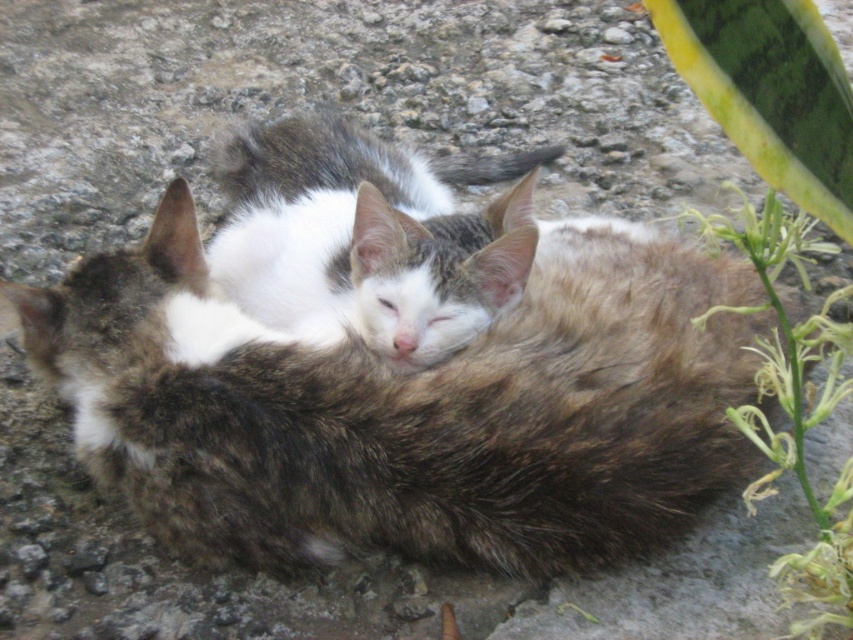
You are a photographer trying to capture a photo of the fluffy brown cat at center and the green leafy plant at right. If you want to ensure both subjects are fully visible in the frame, which one should you position closer to the camera to avoid cropping?

The fluffy brown cat at center might be wider than the green leafy plant at right, so positioning the fluffy brown cat at center closer to the camera would help ensure it fits without cropping, while the narrower green leafy plant at right could be placed slightly farther back.

You are a photographer trying to capture a closeup of the white fur cat at center. Since the fluffy brown cat at center is blocking part of the view, can you determine if you need to adjust your position to get a clear shot?

The fluffy brown cat at center is positioned under the white fur cat at center, so you can adjust your position slightly upward to avoid the fluffy brown cat at center and get a clear shot of the white fur cat at center.

You are a photographer trying to capture a closeup of the smaller cat. You notice a point at coordinates (409, 406). Is this point on the smaller cat or the larger cat?

The point at coordinates (409, 406) is on the fluffy brown cat at center, which is the larger cat. Therefore, this point is not on the smaller cat.